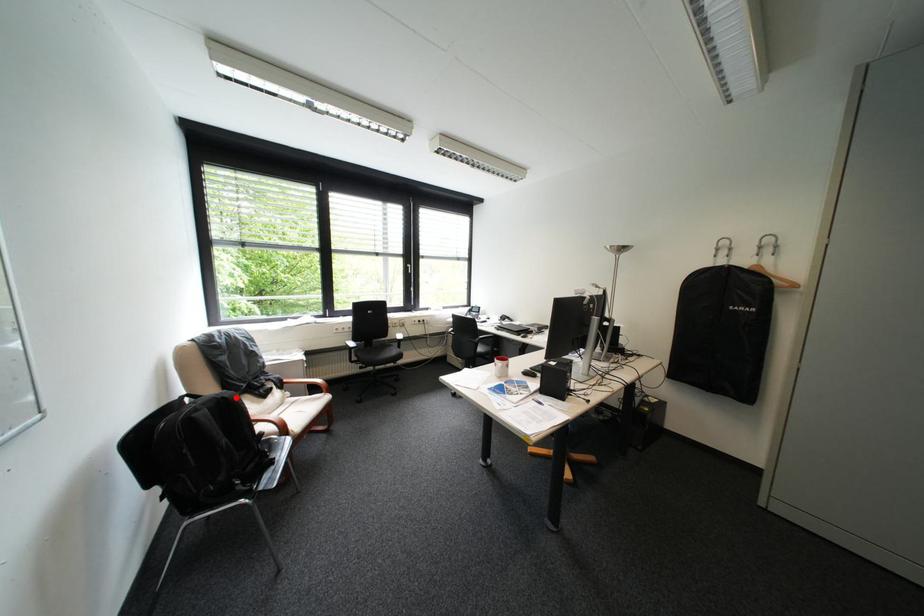
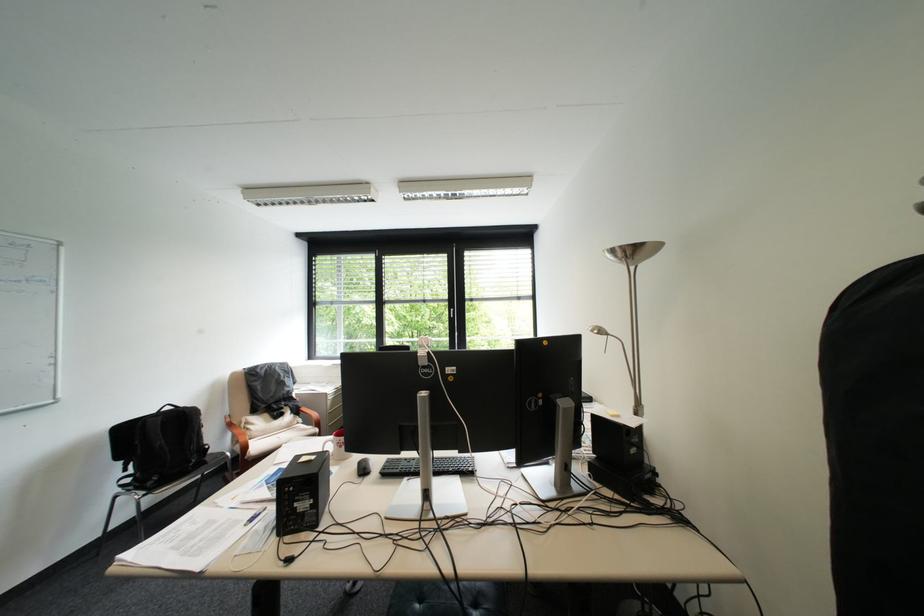
Question: I am providing you with two images of the same scene from different viewpoints. Image1 has a red point marked. In image2, the corresponding 3D location appears at what relative position? Reply with the corresponding letter.

Choices:
 (A) Closer
 (B) Farther

Answer: (B)